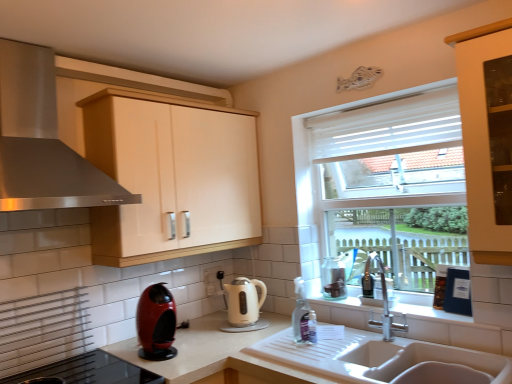
Question: Which direction should I rotate to face white glossy electric kettle at center, acting as the 1th kitchen appliance starting from the right, — up or down?

Choices:
 (A) up
 (B) down

Answer: (B)

Question: Could you tell me if stainless steel range hood at upper left is facing white matte countertop at sink?

Choices:
 (A) no
 (B) yes

Answer: (A)

Question: Is stainless steel range hood at upper left turned away from white matte countertop at sink?

Choices:
 (A) yes
 (B) no

Answer: (B)

Question: Can we say stainless steel range hood at upper left lies outside white matte countertop at sink?

Choices:
 (A) no
 (B) yes

Answer: (B)

Question: Does stainless steel range hood at upper left appear on the right side of white matte countertop at sink?

Choices:
 (A) no
 (B) yes

Answer: (A)

Question: Does stainless steel range hood at upper left have a greater height compared to white matte countertop at sink?

Choices:
 (A) yes
 (B) no

Answer: (A)

Question: From the image's perspective, is stainless steel range hood at upper left located beneath white matte countertop at sink?

Choices:
 (A) no
 (B) yes

Answer: (A)

Question: Considering the relative sizes of clear glass jar at right and white ceramic sink at lower center in the image provided, is clear glass jar at right smaller than white ceramic sink at lower center?

Choices:
 (A) no
 (B) yes

Answer: (B)

Question: Could you tell me if clear glass jar at right is turned towards white ceramic sink at lower center?

Choices:
 (A) yes
 (B) no

Answer: (B)

Question: Is clear glass jar at right at the left side of white ceramic sink at lower center?

Choices:
 (A) no
 (B) yes

Answer: (B)

Question: Is clear glass jar at right thinner than white ceramic sink at lower center?

Choices:
 (A) yes
 (B) no

Answer: (A)

Question: Is clear glass jar at right oriented away from white ceramic sink at lower center?

Choices:
 (A) no
 (B) yes

Answer: (A)

Question: Is clear glass jar at right further to the viewer compared to white ceramic sink at lower center?

Choices:
 (A) yes
 (B) no

Answer: (A)

Question: Would you say stainless steel range hood at upper left is a long distance from white glossy electric kettle at center, marked as the second kitchen appliance in a front-to-back arrangement?

Choices:
 (A) no
 (B) yes

Answer: (B)